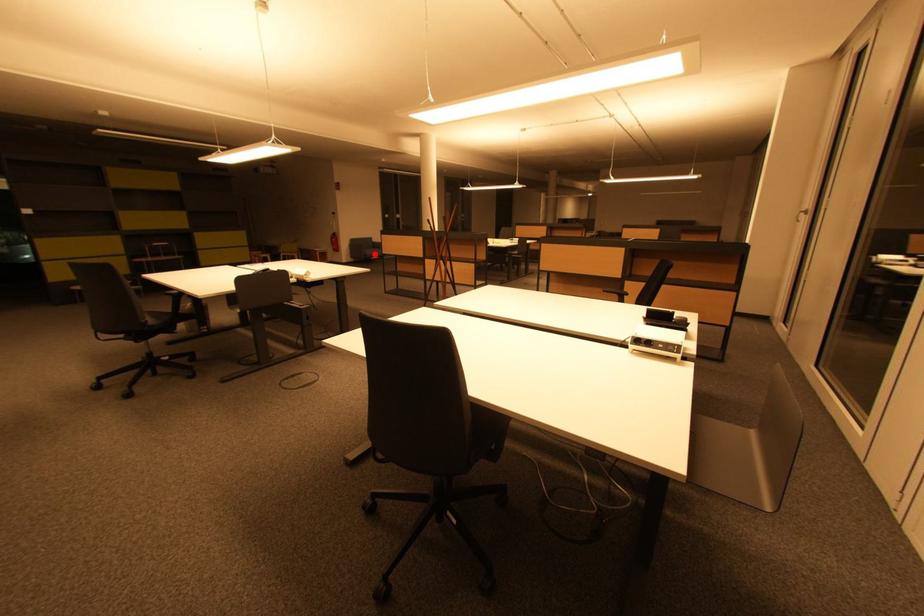
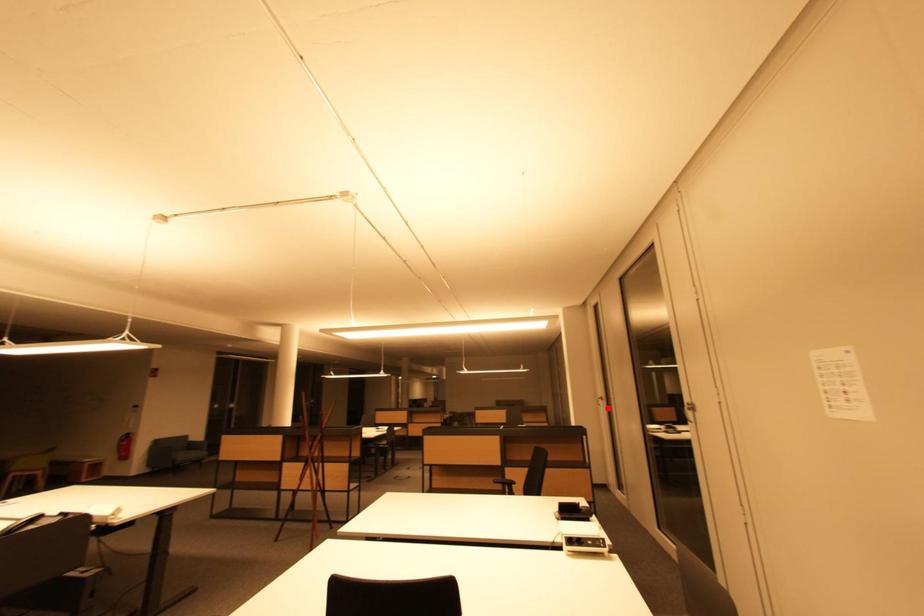
I am providing you with two images of the same scene from different viewpoints. A red point is marked on the first image and another point is marked on the second image. Are the points marked in image1 and image2 representing the same 3D position?

No